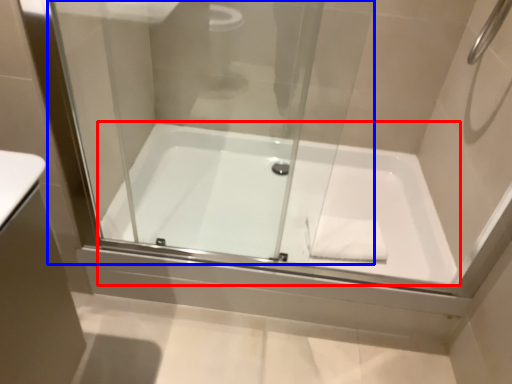
Question: Which of the following is the farthest to the observer, bathtub (highlighted by a red box) or glass door (highlighted by a blue box)?

Choices:
 (A) bathtub
 (B) glass door

Answer: (A)